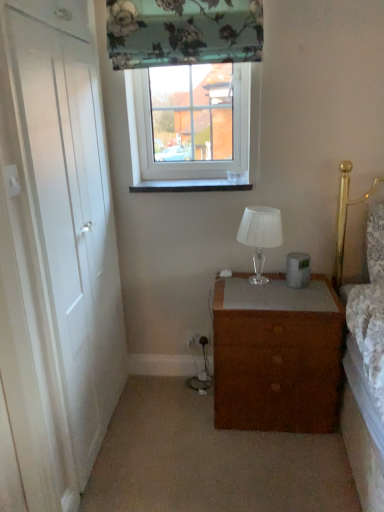
The width and height of the screenshot is (384, 512). Find the location of `vacant space in front of white wooden door at left`. vacant space in front of white wooden door at left is located at coordinates (123, 471).